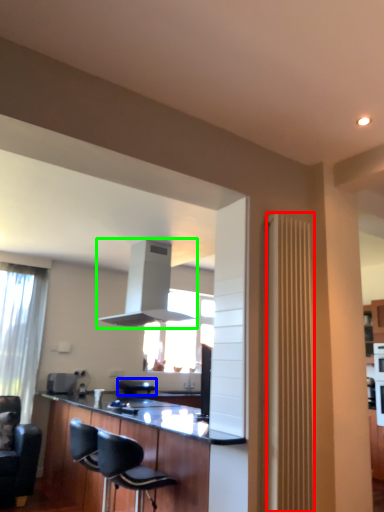
Question: Based on their relative distances, which object is nearer to radiator (highlighted by a red box)? Choose from armchair (highlighted by a blue box) and exhaust hood (highlighted by a green box).

Choices:
 (A) armchair
 (B) exhaust hood

Answer: (B)